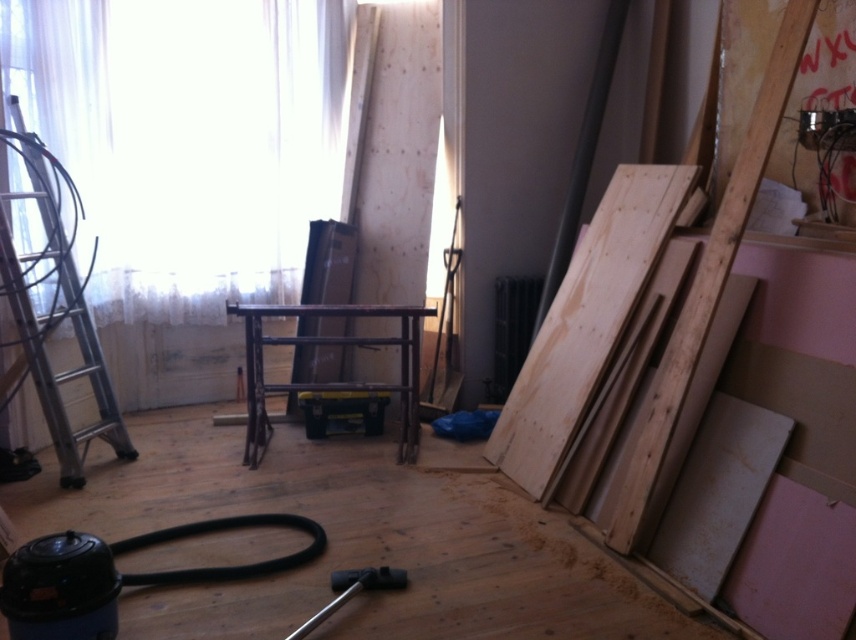
You are standing in the room and want to know the exact location of the white sheer curtain at upper left. Can you tell me its coordinates?

The white sheer curtain at upper left is located at coordinates point [186,140].